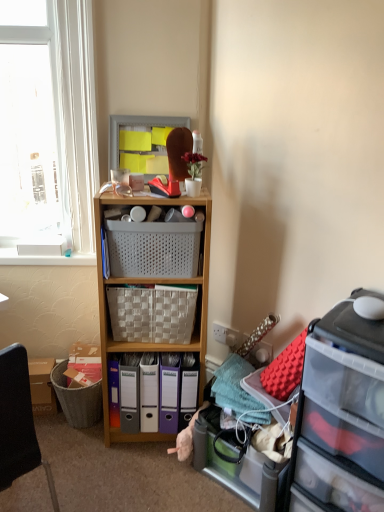
Question: From the image's perspective, is translucent plastic storage box at lower right over white plastic basket at center, acting as the first picnic basket starting from the top?

Choices:
 (A) yes
 (B) no

Answer: (B)

Question: Is white plastic basket at center, acting as the first picnic basket starting from the top, inside translucent plastic storage box at lower right?

Choices:
 (A) no
 (B) yes

Answer: (A)

Question: Is translucent plastic storage box at lower right turned away from white plastic basket at center, acting as the first picnic basket starting from the top?

Choices:
 (A) no
 (B) yes

Answer: (A)

Question: Considering the relative positions of translucent plastic storage box at lower right and white plastic basket at center, the second picnic basket in the bottom-to-top sequence, in the image provided, is translucent plastic storage box at lower right to the right of white plastic basket at center, the second picnic basket in the bottom-to-top sequence, from the viewer's perspective?

Choices:
 (A) no
 (B) yes

Answer: (B)

Question: From a real-world perspective, is translucent plastic storage box at lower right on top of white plastic basket at center, acting as the first picnic basket starting from the top?

Choices:
 (A) yes
 (B) no

Answer: (B)

Question: Is translucent plastic storage box at lower right placed right next to white plastic basket at center, the second picnic basket in the bottom-to-top sequence?

Choices:
 (A) no
 (B) yes

Answer: (A)

Question: From a real-world perspective, is clear plastic drawer at right over black leather chair at lower left?

Choices:
 (A) no
 (B) yes

Answer: (A)

Question: Does clear plastic drawer at right appear on the left side of black leather chair at lower left?

Choices:
 (A) no
 (B) yes

Answer: (A)

Question: Is black leather chair at lower left completely or partially inside clear plastic drawer at right?

Choices:
 (A) yes
 (B) no

Answer: (B)

Question: Is the depth of clear plastic drawer at right less than that of black leather chair at lower left?

Choices:
 (A) yes
 (B) no

Answer: (B)

Question: Is clear plastic drawer at right shorter than black leather chair at lower left?

Choices:
 (A) no
 (B) yes

Answer: (B)

Question: Are clear plastic drawer at right and black leather chair at lower left located far from each other?

Choices:
 (A) no
 (B) yes

Answer: (A)

Question: Is purple plastic file folders at lower center, arranged as the 3th bin when viewed from the left, bigger than matte plastic bin at center, the second bin in the left-to-right sequence?

Choices:
 (A) yes
 (B) no

Answer: (B)